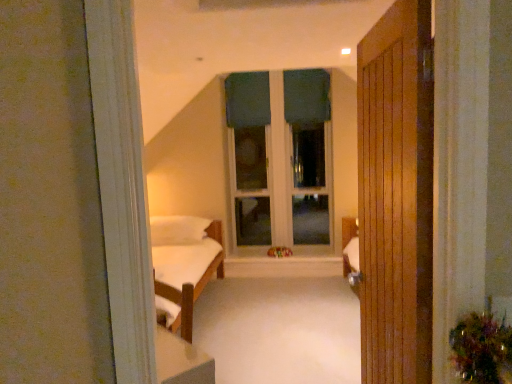
Question: Does teal fabric window at center have a greater width compared to white soft pillow at center?

Choices:
 (A) no
 (B) yes

Answer: (A)

Question: Considering the relative sizes of teal fabric window at center and white soft pillow at center in the image provided, is teal fabric window at center taller than white soft pillow at center?

Choices:
 (A) yes
 (B) no

Answer: (A)

Question: Is teal fabric window at center at the right side of white soft pillow at center?

Choices:
 (A) yes
 (B) no

Answer: (A)

Question: Are teal fabric window at center and white soft pillow at center making contact?

Choices:
 (A) no
 (B) yes

Answer: (A)

Question: Could white soft pillow at center be considered to be inside teal fabric window at center?

Choices:
 (A) no
 (B) yes

Answer: (A)

Question: Is wooden door at right wider or thinner than dark green fabric curtain at upper center, which is the first curtain from right to left?

Choices:
 (A) thin
 (B) wide

Answer: (B)

Question: Does point (398, 162) appear closer or farther from the camera than point (307, 82)?

Choices:
 (A) closer
 (B) farther

Answer: (A)

Question: In terms of size, does wooden door at right appear bigger or smaller than dark green fabric curtain at upper center, which is the second curtain in left-to-right order?

Choices:
 (A) big
 (B) small

Answer: (A)

Question: From the image's perspective, is wooden door at right above or below dark green fabric curtain at upper center, which is the first curtain from right to left?

Choices:
 (A) below
 (B) above

Answer: (A)

Question: In terms of width, does white soft pillow at center look wider or thinner when compared to wooden door at right?

Choices:
 (A) thin
 (B) wide

Answer: (B)

Question: Is white soft pillow at center spatially inside wooden door at right, or outside of it?

Choices:
 (A) inside
 (B) outside

Answer: (B)

Question: Visually, is white soft pillow at center positioned to the left or to the right of wooden door at right?

Choices:
 (A) right
 (B) left

Answer: (B)

Question: Considering the positions of white soft pillow at center and wooden door at right in the image, is white soft pillow at center taller or shorter than wooden door at right?

Choices:
 (A) tall
 (B) short

Answer: (B)

Question: In terms of height, does teal fabric window at center look taller or shorter compared to green fabric curtain at center, which is the second curtain in right-to-left order?

Choices:
 (A) tall
 (B) short

Answer: (A)

Question: From a real-world perspective, is teal fabric window at center above or below green fabric curtain at center, which is the second curtain in right-to-left order?

Choices:
 (A) below
 (B) above

Answer: (A)